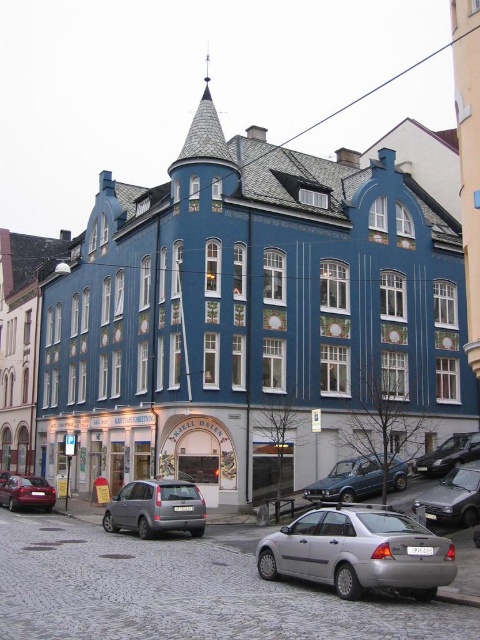
You are standing in front of the multi story building with deep blue facade. You see a point at coordinate [359,552]. Is this point located on the building?

The point at coordinate [359,552] is located on the satin silver sedan at lower center, not on the building.

You are a delivery driver who needs to park your satin silver sedan at lower center as close as possible to the matte blue building at left. According to the scene, what is the minimum distance you can achieve between your car and the building?

The minimum distance you can achieve between the satin silver sedan at lower center and the matte blue building at left is 65.38 meters.